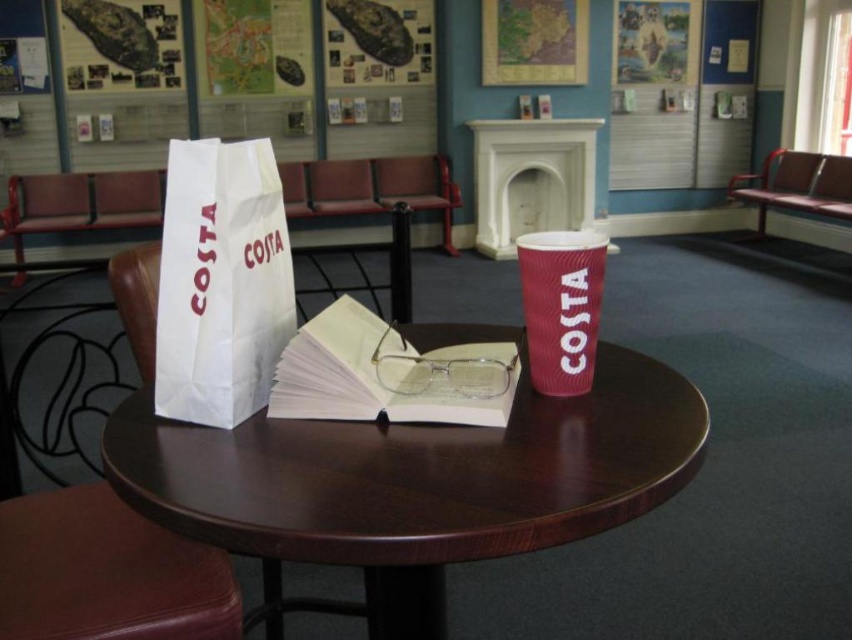
Between wooden round table at center and light yellow paper book at center, which one is positioned lower?

wooden round table at center is below.

You are a GUI agent. You are given a task and a screenshot of the screen. Output one action in this format:
    pyautogui.click(x=<x>, y=<y>)
    Task: Click on the wooden round table at center
    
    Given the screenshot: What is the action you would take?
    pyautogui.click(x=413, y=484)

The width and height of the screenshot is (852, 640). Find the location of `wooden round table at center`. wooden round table at center is located at coordinates (413, 484).

In order to click on light yellow paper book at center in this screenshot , I will do `click(389, 374)`.

Who is more forward, (295, 384) or (580, 355)?

Positioned in front is point (295, 384).

At what (x,y) coordinates should I click in order to perform the action: click on light yellow paper book at center. Please return your answer as a coordinate pair (x, y). Looking at the image, I should click on (389, 374).

The image size is (852, 640). Describe the element at coordinates (413, 484) in the screenshot. I see `wooden round table at center` at that location.

Is wooden round table at center below white paper bag at center?

Yes.

Is point (439, 428) farther from viewer compared to point (245, 148)?

That is False.

Where is `wooden round table at center`? This screenshot has width=852, height=640. wooden round table at center is located at coordinates (413, 484).